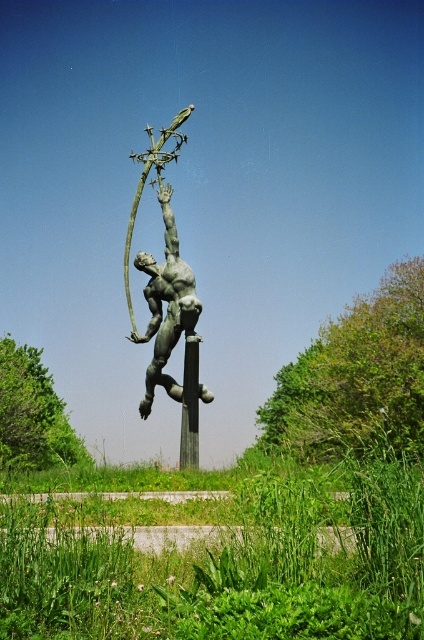
Who is shorter, bronze statue at center or green polished stone pole at center?

With less height is green polished stone pole at center.

Is point (153, 376) less distant than point (190, 374)?

No, (153, 376) is further to viewer.

Does point (180, 400) come in front of point (187, 380)?

No, (180, 400) is behind (187, 380).

I want to click on bronze statue at center, so click(x=167, y=307).

Which is above, green leafy tree at left or bronze statue at center?

bronze statue at center

Between point (22, 387) and point (197, 314), which one is positioned in front?

Point (197, 314)

Locate an element on the screen. This screenshot has width=424, height=640. green leafy tree at left is located at coordinates (33, 413).

Is point (348, 323) farther from viewer compared to point (0, 349)?

No, it is not.

Who is lower down, green leafy tree at center or green leafy tree at left?

green leafy tree at left

Which is behind, point (315, 440) or point (39, 380)?

Point (39, 380)

Locate an element on the screen. Image resolution: width=424 pixels, height=640 pixels. green leafy tree at center is located at coordinates (357, 376).